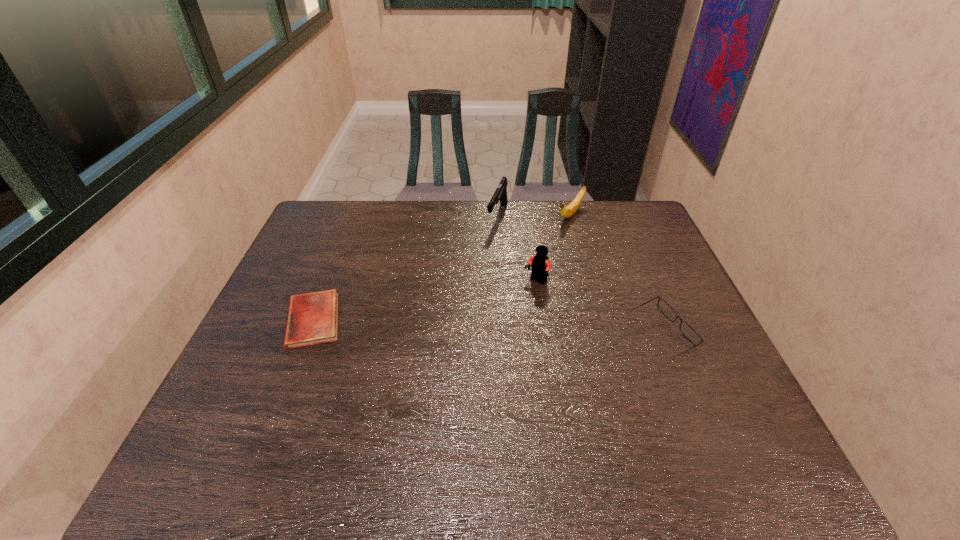
Where is `free space in the image that satisfies the following two spatial constraints: 1. on the back side of the diary; 2. on the right side of the fourth object from left to right`? The width and height of the screenshot is (960, 540). free space in the image that satisfies the following two spatial constraints: 1. on the back side of the diary; 2. on the right side of the fourth object from left to right is located at coordinates (354, 215).

Identify the location of free point that satisfies the following two spatial constraints: 1. on the back side of the second object from right to left; 2. on the right side of the gun. Image resolution: width=960 pixels, height=540 pixels. (497, 215).

Find the location of `free spot that satisfies the following two spatial constraints: 1. on the front side of the second shortest object; 2. with the lenses facing outward on the third tallest object`. free spot that satisfies the following two spatial constraints: 1. on the front side of the second shortest object; 2. with the lenses facing outward on the third tallest object is located at coordinates (605, 336).

This screenshot has width=960, height=540. What are the coordinates of `vacant position in the image that satisfies the following two spatial constraints: 1. on the front side of the second shortest object; 2. with the lenses facing outward on the third shortest object` in the screenshot? It's located at (605, 336).

This screenshot has width=960, height=540. What are the coordinates of `free space that satisfies the following two spatial constraints: 1. on the back side of the gun; 2. on the right side of the fourth object from left to right` in the screenshot? It's located at (497, 215).